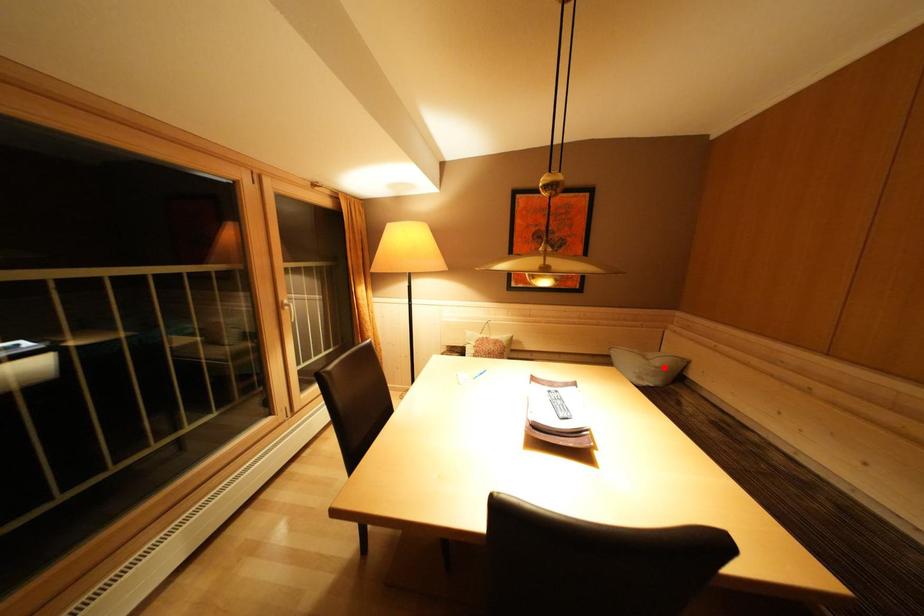
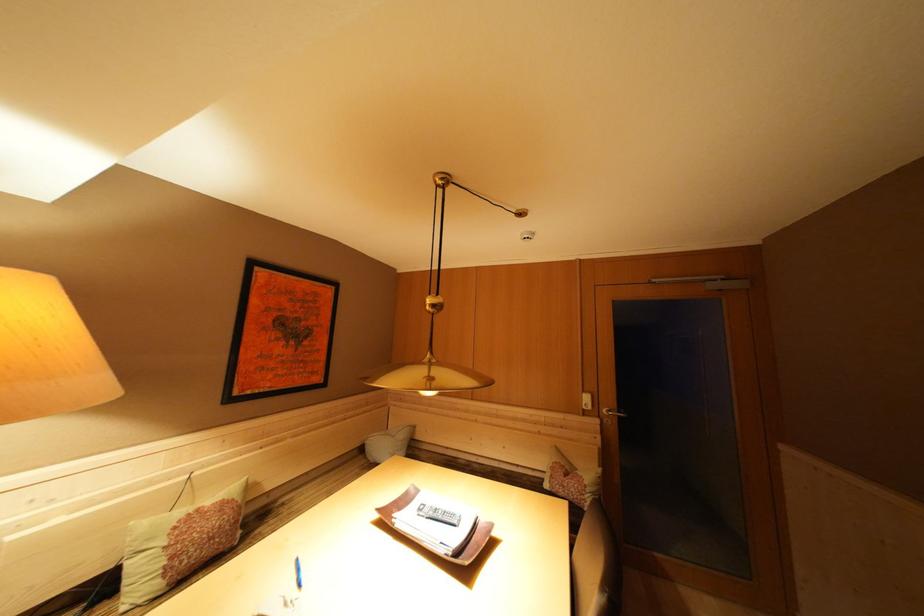
Question: A red point is marked in image1. In image2, is the corresponding 3D point closer to the camera or farther? Reply with the corresponding letter.

Choices:
 (A) The corresponding 3D point is closer.
 (B) The corresponding 3D point is farther.

Answer: (B)